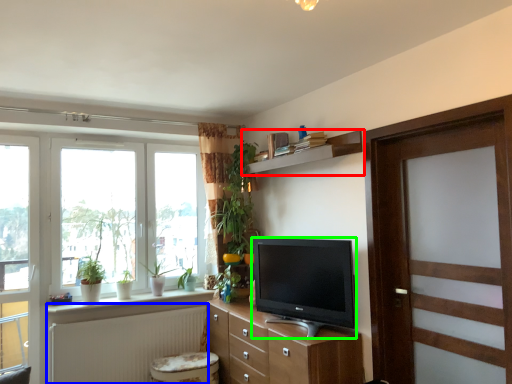
Question: Considering the real-world distances, which object is farthest from shelf (highlighted by a red box)? radiator (highlighted by a blue box) or television (highlighted by a green box)?

Choices:
 (A) radiator
 (B) television

Answer: (A)